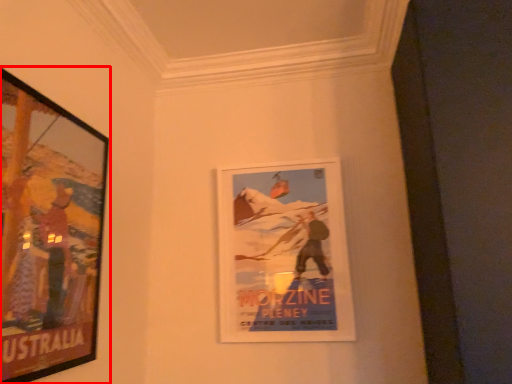
Question: From the image's perspective, where is picture frame (annotated by the red box) located relative to picture frame?

Choices:
 (A) above
 (B) below

Answer: (A)